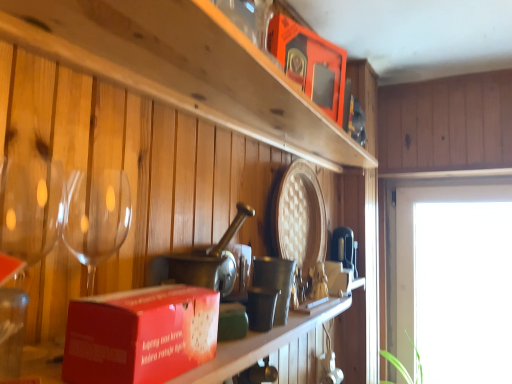
Where is `vacant space to the left of matte orange box at upper center, the second box when ordered from front to back`? The width and height of the screenshot is (512, 384). vacant space to the left of matte orange box at upper center, the second box when ordered from front to back is located at coordinates (257, 120).